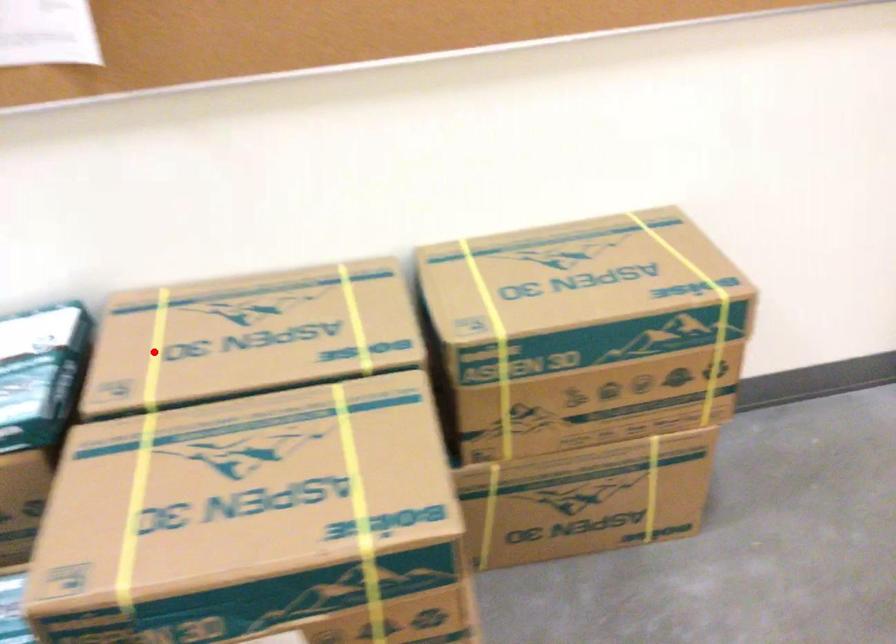
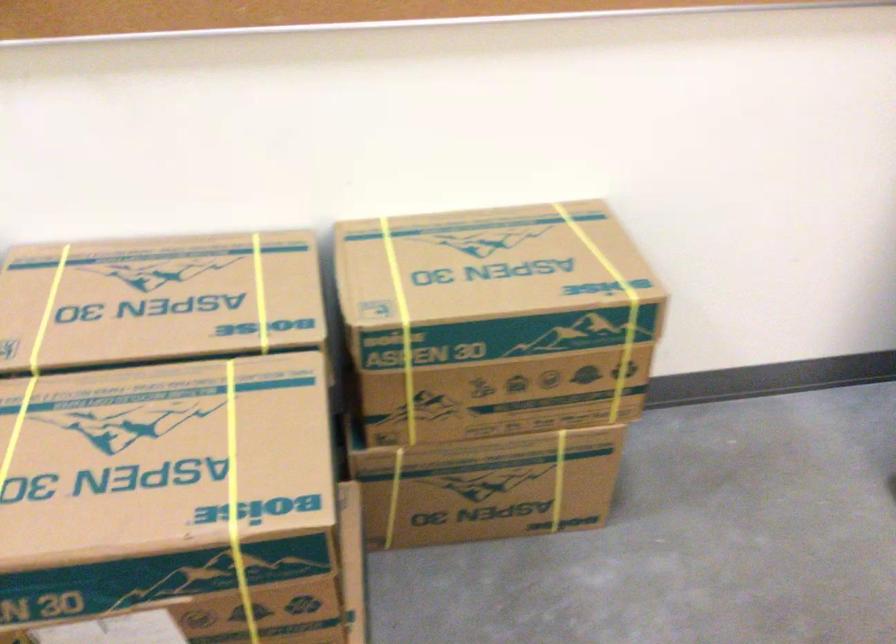
The point at the highlighted location is marked in the first image. Where is the corresponding point in the second image?

(47, 310)